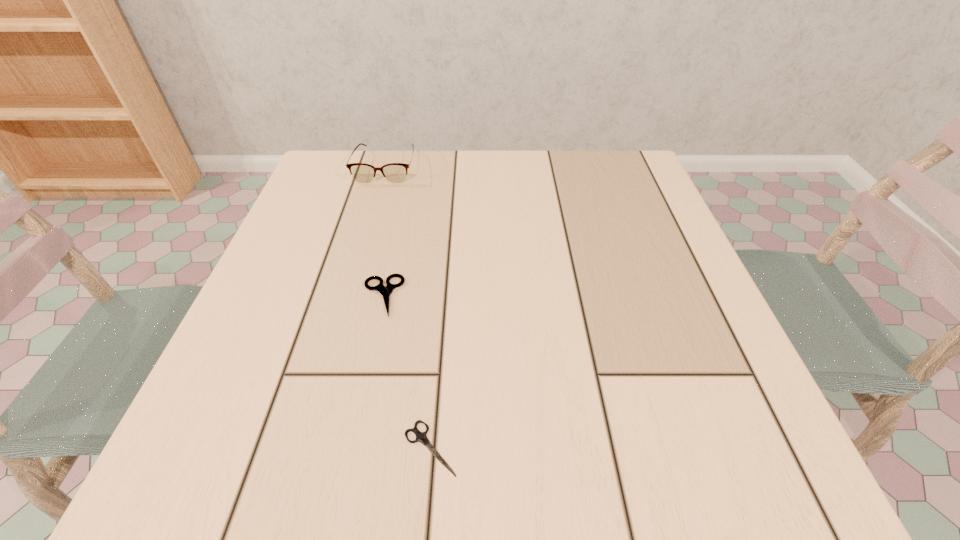
The width and height of the screenshot is (960, 540). I want to click on object that stands as the second closest to the nearest object, so click(x=394, y=172).

This screenshot has width=960, height=540. I want to click on the second closest object to the farthest object, so click(421, 437).

The image size is (960, 540). Identify the location of blank area in the image that satisfies the following two spatial constraints: 1. on the face of the tallest object; 2. on the right side of the shortest object. (305, 448).

Locate an element on the screen. Image resolution: width=960 pixels, height=540 pixels. vacant point that satisfies the following two spatial constraints: 1. on the face of the second tallest object; 2. on the right side of the spectacles is located at coordinates (348, 296).

The image size is (960, 540). I want to click on vacant region that satisfies the following two spatial constraints: 1. on the face of the shorter shears; 2. on the right side of the spectacles, so click(x=305, y=448).

Locate an element on the screen. This screenshot has width=960, height=540. free space that satisfies the following two spatial constraints: 1. on the face of the tallest object; 2. on the left side of the rightmost object is located at coordinates (305, 448).

Find the location of a particular element. The image size is (960, 540). vacant space that satisfies the following two spatial constraints: 1. on the face of the farthest object; 2. on the left side of the right shears is located at coordinates (305, 448).

Find the location of a particular element. This screenshot has width=960, height=540. free space that satisfies the following two spatial constraints: 1. on the face of the tallest object; 2. on the left side of the second nearest object is located at coordinates (348, 296).

Where is `vacant space that satisfies the following two spatial constraints: 1. on the face of the right shears; 2. on the right side of the tallest object`? The image size is (960, 540). vacant space that satisfies the following two spatial constraints: 1. on the face of the right shears; 2. on the right side of the tallest object is located at coordinates (305, 448).